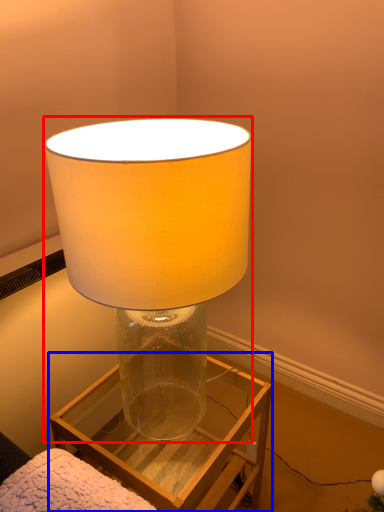
Question: Among these objects, which one is farthest to the camera, lamp (highlighted by a red box) or furniture (highlighted by a blue box)?

Choices:
 (A) lamp
 (B) furniture

Answer: (B)